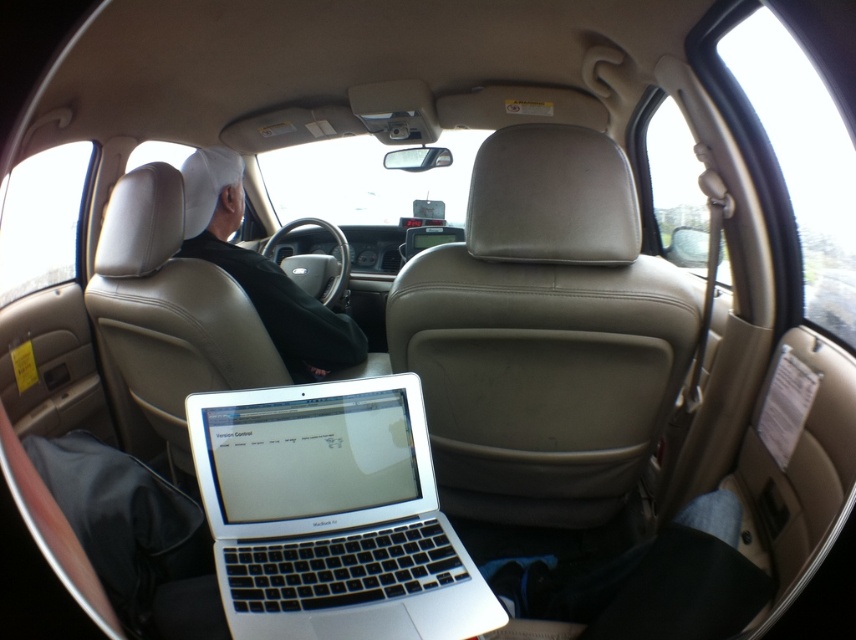
Does silver metallic laptop at center appear on the right side of white leather jacket at upper left?

Indeed, silver metallic laptop at center is positioned on the right side of white leather jacket at upper left.

Does silver metallic laptop at center have a larger size compared to white leather jacket at upper left?

No, silver metallic laptop at center is not bigger than white leather jacket at upper left.

Image resolution: width=856 pixels, height=640 pixels. In order to click on silver metallic laptop at center in this screenshot , I will do `click(331, 515)`.